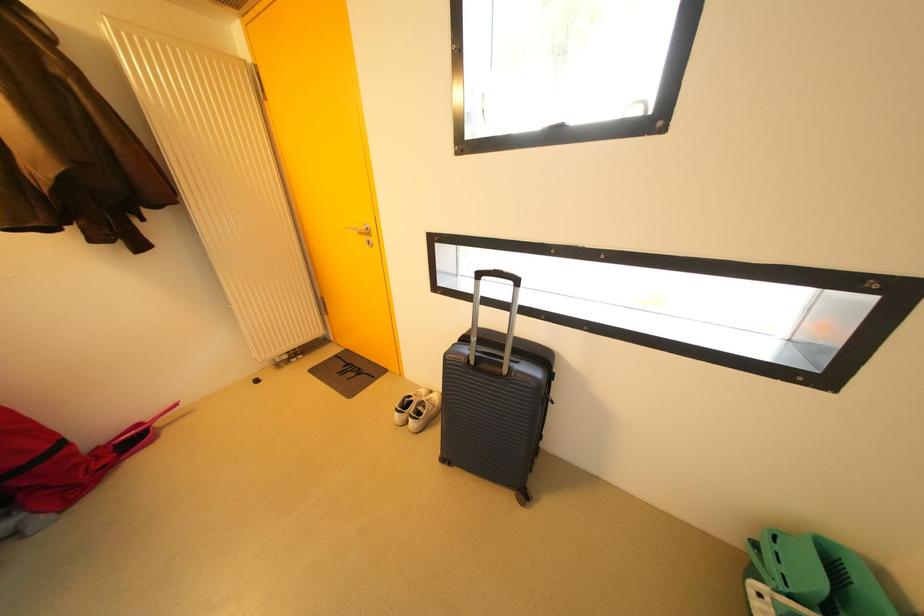
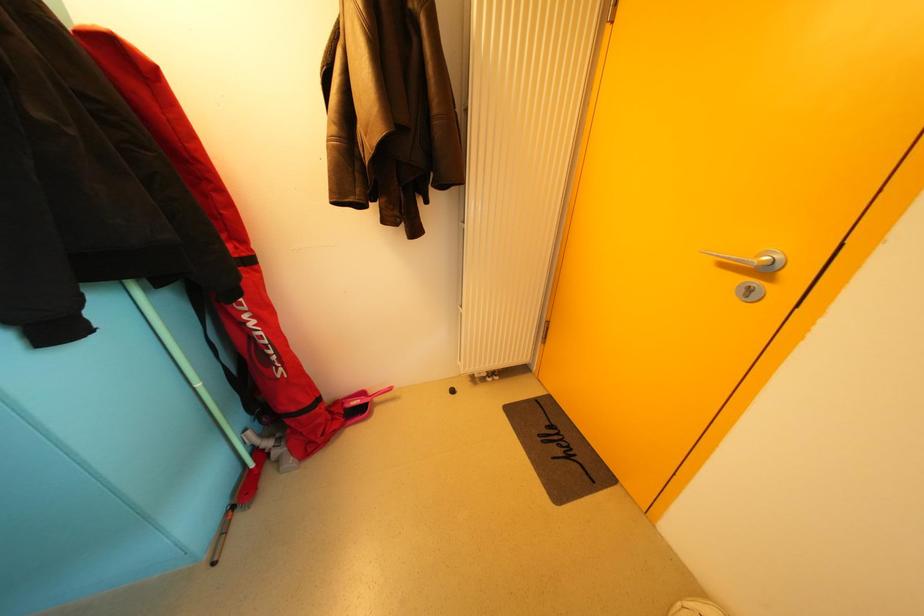
Question: The first image is from the beginning of the video and the second image is from the end. How did the camera likely rotate when shooting the video?

Choices:
 (A) Left
 (B) Right
 (C) Up
 (D) Down

Answer: (A)